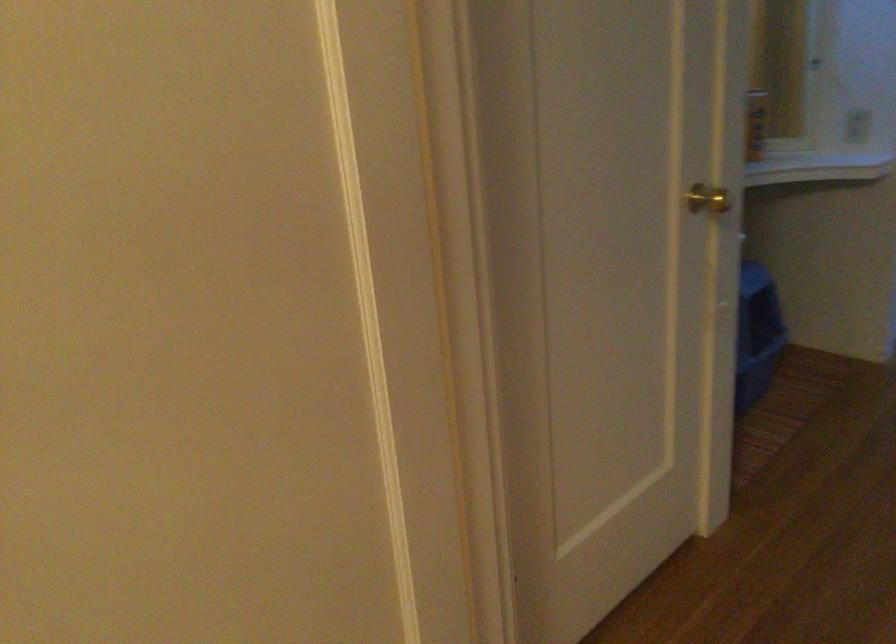
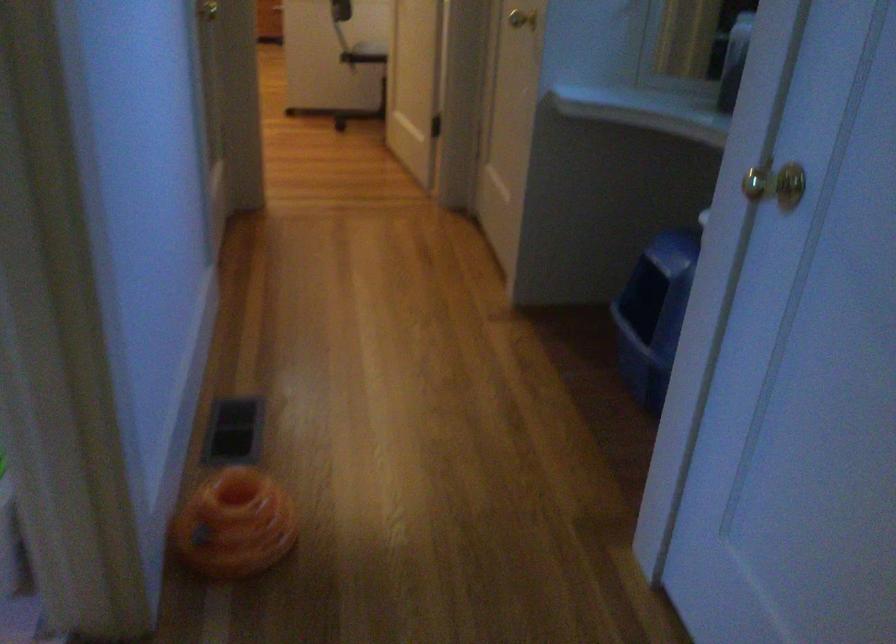
In the second image, find the point that corresponds to (660,236) in the first image.

(521, 19)